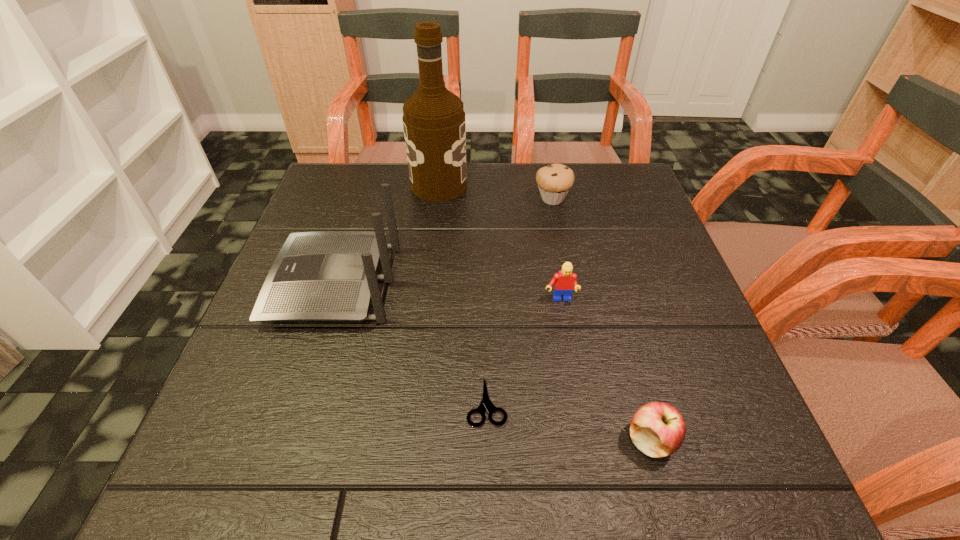
In order to click on free space between the apple and the muffin in this screenshot , I will do `click(602, 320)`.

I want to click on free space between the second tallest object and the apple, so click(x=492, y=362).

Find the location of a particular element. This screenshot has width=960, height=540. free space between the shortest object and the router is located at coordinates (411, 342).

The width and height of the screenshot is (960, 540). I want to click on free space between the tallest object and the third object from left to right, so click(463, 293).

Find the location of a particular element. The image size is (960, 540). object that can be found as the third closest to the apple is located at coordinates (329, 275).

Where is `object that is the second closest to the apple`? The height and width of the screenshot is (540, 960). object that is the second closest to the apple is located at coordinates (564, 281).

Find the location of a particular element. Image resolution: width=960 pixels, height=540 pixels. free point that satisfies the following two spatial constraints: 1. on the label of the tallest object; 2. on the right side of the apple is located at coordinates (410, 441).

Image resolution: width=960 pixels, height=540 pixels. I want to click on free space that satisfies the following two spatial constraints: 1. on the back side of the apple; 2. on the front-facing side of the router, so click(607, 283).

At what (x,y) coordinates should I click in order to perform the action: click on free spot that satisfies the following two spatial constraints: 1. on the front side of the apple; 2. on the left side of the shortest object. Please return your answer as a coordinate pair (x, y). Image resolution: width=960 pixels, height=540 pixels. Looking at the image, I should click on pos(488,441).

Where is `vacant point that satisfies the following two spatial constraints: 1. on the back side of the fourth object from right to left; 2. on the left side of the muffin`? The image size is (960, 540). vacant point that satisfies the following two spatial constraints: 1. on the back side of the fourth object from right to left; 2. on the left side of the muffin is located at coordinates pyautogui.click(x=485, y=199).